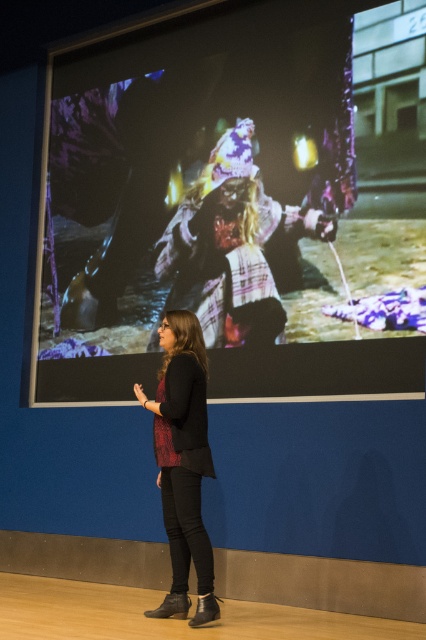
Between point (152, 362) and point (203, 461), which one is positioned behind?

The point (152, 362) is more distant.

Between matte black screen at center and matte black pants at center, which one appears on the left side from the viewer's perspective?

From the viewer's perspective, matte black pants at center appears more on the left side.

Is point (180, 200) closer to camera compared to point (192, 323)?

No, (180, 200) is behind (192, 323).

I want to click on matte black screen at center, so click(236, 202).